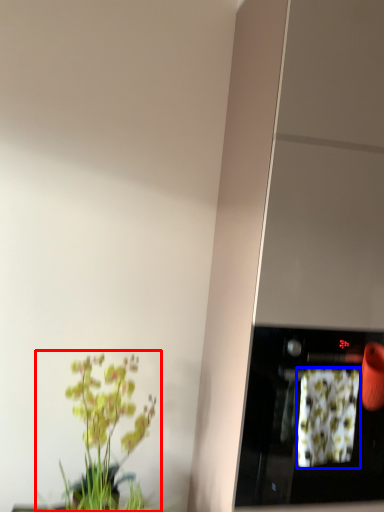
Question: Which of the following is the farthest to the observer, houseplant (highlighted by a red box) or flower (highlighted by a blue box)?

Choices:
 (A) houseplant
 (B) flower

Answer: (A)